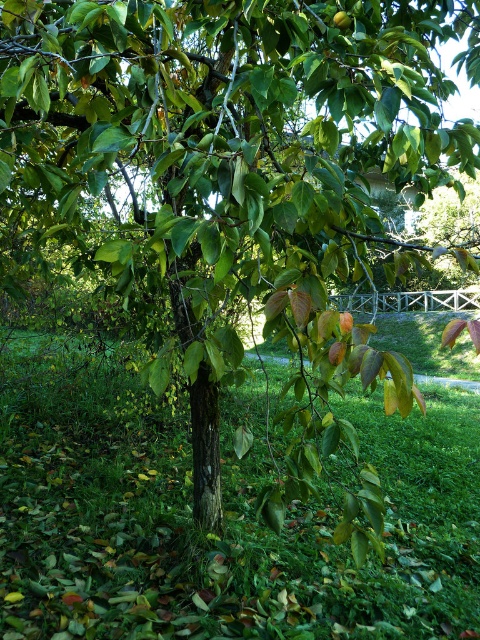
Question: Which point appears closest to the camera in this image?

Choices:
 (A) (337, 26)
 (B) (35, 339)

Answer: (A)

Question: Can you confirm if green grassy at center is positioned below green matte apple at center?

Choices:
 (A) yes
 (B) no

Answer: (A)

Question: Among these objects, which one is farthest from the camera?

Choices:
 (A) green grassy at center
 (B) green matte apple at center

Answer: (A)

Question: Does green grassy at center appear on the right side of green matte apple at center?

Choices:
 (A) no
 (B) yes

Answer: (B)

Question: Is green grassy at center to the right of green matte apple at center from the viewer's perspective?

Choices:
 (A) yes
 (B) no

Answer: (A)